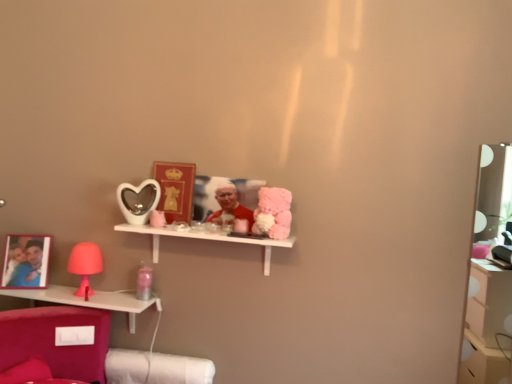
Question: Is matte pink lamp at left looking in the opposite direction of pink plastic lamp at lower left, the 1th shelf in the bottom-to-top sequence?

Choices:
 (A) no
 (B) yes

Answer: (A)

Question: Does matte pink lamp at left appear on the right side of pink plastic lamp at lower left, marked as the 2th shelf in a top-to-bottom arrangement?

Choices:
 (A) no
 (B) yes

Answer: (B)

Question: Does matte pink lamp at left have a larger size compared to pink plastic lamp at lower left, which is counted as the 2th shelf, starting from the right?

Choices:
 (A) yes
 (B) no

Answer: (B)

Question: From a real-world perspective, is matte pink lamp at left beneath pink plastic lamp at lower left, arranged as the first shelf when viewed from the left?

Choices:
 (A) no
 (B) yes

Answer: (A)

Question: Can you confirm if matte pink lamp at left is smaller than pink plastic lamp at lower left, marked as the 2th shelf in a top-to-bottom arrangement?

Choices:
 (A) no
 (B) yes

Answer: (B)

Question: Considering the relative sizes of matte pink lamp at left and pink plastic lamp at lower left, arranged as the first shelf when viewed from the left, in the image provided, is matte pink lamp at left shorter than pink plastic lamp at lower left, arranged as the first shelf when viewed from the left,?

Choices:
 (A) yes
 (B) no

Answer: (B)

Question: Is pink plastic lamp at lower left, which is counted as the 2th shelf, starting from the right, not within white glossy shelf at center, which is the 1th shelf in right-to-left order?

Choices:
 (A) no
 (B) yes

Answer: (B)

Question: From the image's perspective, is pink plastic lamp at lower left, which is counted as the 2th shelf, starting from the right, located above white glossy shelf at center, which is the second shelf in left-to-right order?

Choices:
 (A) yes
 (B) no

Answer: (B)

Question: From a real-world perspective, is pink plastic lamp at lower left, which is counted as the 2th shelf, starting from the right, physically below white glossy shelf at center, which is the 1th shelf in right-to-left order?

Choices:
 (A) yes
 (B) no

Answer: (A)

Question: Does pink plastic lamp at lower left, arranged as the first shelf when viewed from the left, contain white glossy shelf at center, marked as the 2th shelf in a bottom-to-top arrangement?

Choices:
 (A) yes
 (B) no

Answer: (B)

Question: Can you confirm if pink plastic lamp at lower left, the 1th shelf in the bottom-to-top sequence, is shorter than white glossy shelf at center, which appears as the first shelf when viewed from the top?

Choices:
 (A) no
 (B) yes

Answer: (B)

Question: Can you confirm if pink plastic lamp at lower left, the 1th shelf in the bottom-to-top sequence, is positioned to the left of white glossy shelf at center, which is the second shelf in left-to-right order?

Choices:
 (A) yes
 (B) no

Answer: (A)

Question: Are matte white heart-shaped mirror at center and smooth red fabric at center making contact?

Choices:
 (A) yes
 (B) no

Answer: (B)